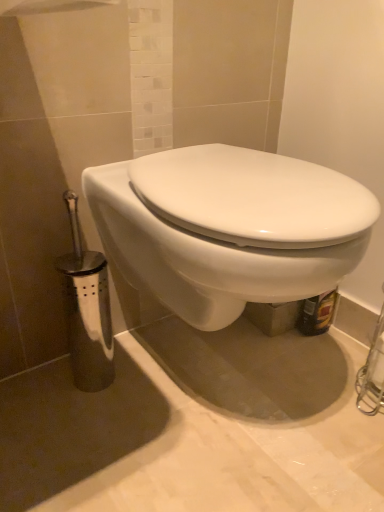
Identify the location of vacant region above white glossy toilet at center (from a real-world perspective). This screenshot has height=512, width=384. (x=246, y=165).